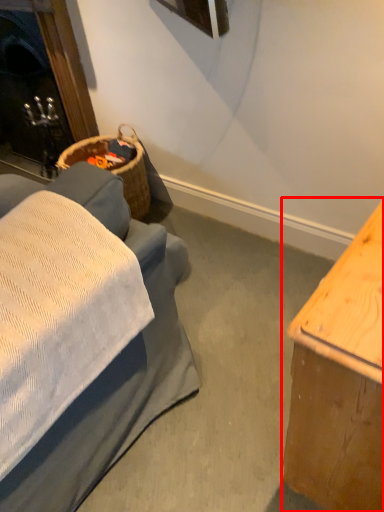
Question: Observing the image, what is the correct spatial positioning of table (annotated by the red box) in reference to fireplace?

Choices:
 (A) left
 (B) right

Answer: (B)